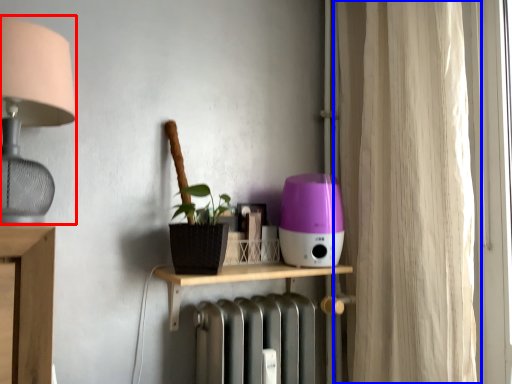
Question: Which object appears closest to the camera in this image, lamp (highlighted by a red box) or curtain (highlighted by a blue box)?

Choices:
 (A) lamp
 (B) curtain

Answer: (A)